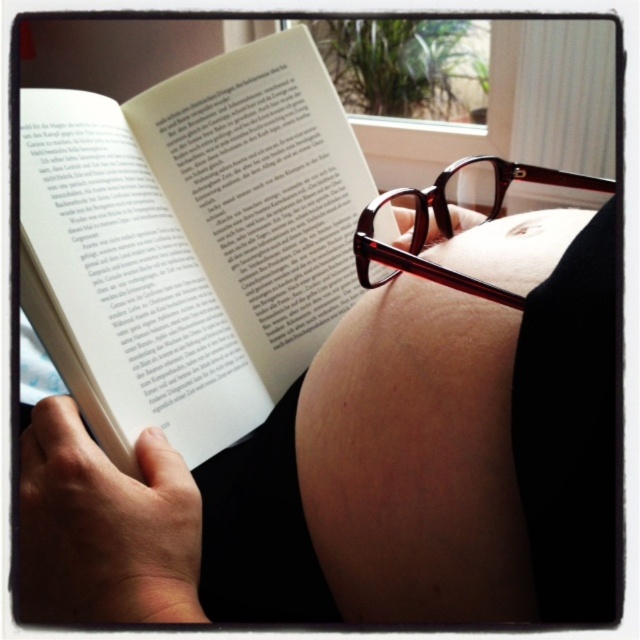
Based on the photo, you are an interior designer planning to place a decorative item on the shelf in the scene. You have a small statue that needs to be positioned between the matte skin belly at center and the white paper at upper left. Based on their positions, where should you place the statue?

The matte skin belly at center is to the right of white paper at upper left, so you should place the statue between the white paper at upper left and the matte skin belly at center, positioning it to the right of the white paper and to the left of the matte skin belly.

You are a photographer trying to capture the scene. The white paper at upper left and the translucent tortoiseshell glasses at center are both in your viewfinder. Which object should you focus on if you want to prioritize capturing the larger object in detail?

The white paper at upper left is larger in size than the translucent tortoiseshell glasses at center, so you should focus on the white paper at upper left to capture the larger object in detail.

You are a photographer trying to capture the scene where the matte skin belly at center and the white paper at upper left are visible. Based on their positions, which object should you focus on first to ensure both are in frame?

The matte skin belly at center is positioned under the white paper at upper left, so focusing on the white paper at upper left first would ensure both are in frame as the belly is below it.